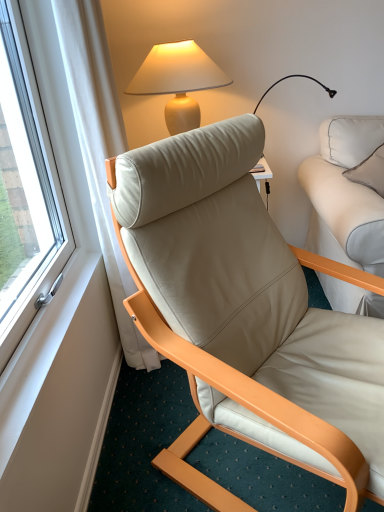
Question: Does beige leather chair at center appear on the right side of white leather pillow at upper right?

Choices:
 (A) no
 (B) yes

Answer: (A)

Question: From the image's perspective, is beige leather chair at center above white leather pillow at upper right?

Choices:
 (A) yes
 (B) no

Answer: (B)

Question: Is beige leather chair at center to the left of white leather pillow at upper right from the viewer's perspective?

Choices:
 (A) yes
 (B) no

Answer: (A)

Question: Is beige leather chair at center next to white leather pillow at upper right and touching it?

Choices:
 (A) no
 (B) yes

Answer: (A)

Question: Does beige leather chair at center have a smaller size compared to white leather pillow at upper right?

Choices:
 (A) no
 (B) yes

Answer: (A)

Question: Does beige leather chair at center lie in front of white leather pillow at upper right?

Choices:
 (A) no
 (B) yes

Answer: (B)

Question: Is beige leather chair at center completely or partially inside matte beige lamp at upper center?

Choices:
 (A) no
 (B) yes

Answer: (A)

Question: Is matte beige lamp at upper center looking in the opposite direction of beige leather chair at center?

Choices:
 (A) yes
 (B) no

Answer: (B)

Question: Is matte beige lamp at upper center outside beige leather chair at center?

Choices:
 (A) no
 (B) yes

Answer: (B)

Question: Considering the relative positions of matte beige lamp at upper center and beige leather chair at center in the image provided, is matte beige lamp at upper center to the right of beige leather chair at center from the viewer's perspective?

Choices:
 (A) yes
 (B) no

Answer: (B)

Question: From a real-world perspective, does matte beige lamp at upper center stand above beige leather chair at center?

Choices:
 (A) no
 (B) yes

Answer: (B)

Question: From the image's perspective, would you say matte beige lamp at upper center is positioned over beige leather chair at center?

Choices:
 (A) no
 (B) yes

Answer: (B)

Question: Does white leather pillow at upper right come in front of beige leather chair at center?

Choices:
 (A) yes
 (B) no

Answer: (B)